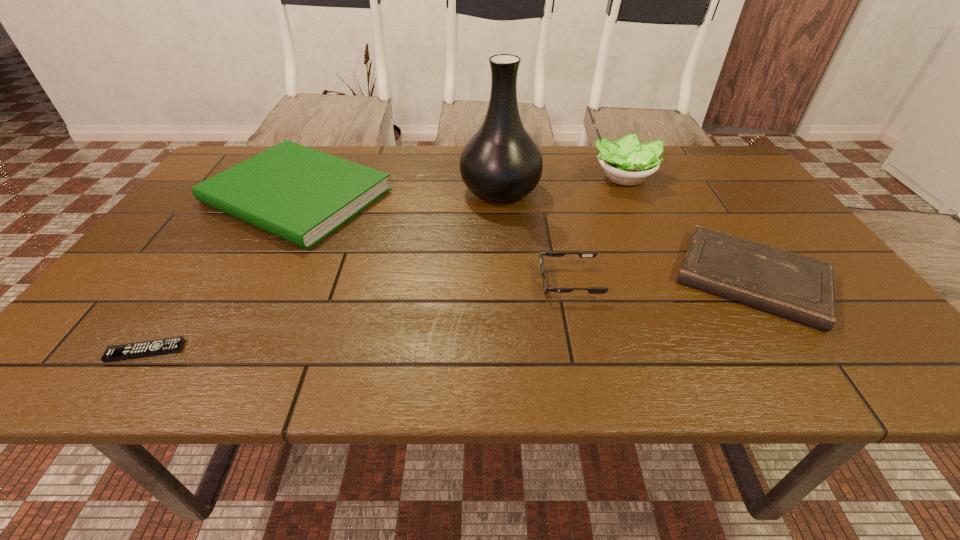
In the image, there is a desktop. Where is `vacant space at the far right corner`? The height and width of the screenshot is (540, 960). vacant space at the far right corner is located at coordinates (726, 158).

Where is `free space between the nearest object and the tallest object`? free space between the nearest object and the tallest object is located at coordinates (323, 271).

Where is `vacant area that lies between the second tallest object and the nearest object`? vacant area that lies between the second tallest object and the nearest object is located at coordinates point(384,264).

This screenshot has width=960, height=540. I want to click on free area in between the fourth tallest object and the third tallest object, so click(433, 239).

Find the location of a particular element. This screenshot has width=960, height=540. free point between the second tallest object and the fourth tallest object is located at coordinates (596, 229).

Identify the location of vacant point located between the nearest object and the lettuce. (384, 264).

Identify the location of empty space that is in between the shortest object and the tallest object. This screenshot has width=960, height=540. (323, 271).

The height and width of the screenshot is (540, 960). Find the location of `free space between the sunglasses and the shorter paperback book`. free space between the sunglasses and the shorter paperback book is located at coordinates (661, 280).

Find the location of a particular element. This screenshot has width=960, height=540. blank region between the sunglasses and the second tallest object is located at coordinates (596, 229).

Locate an element on the screen. empty space between the nearest object and the vase is located at coordinates (323, 271).